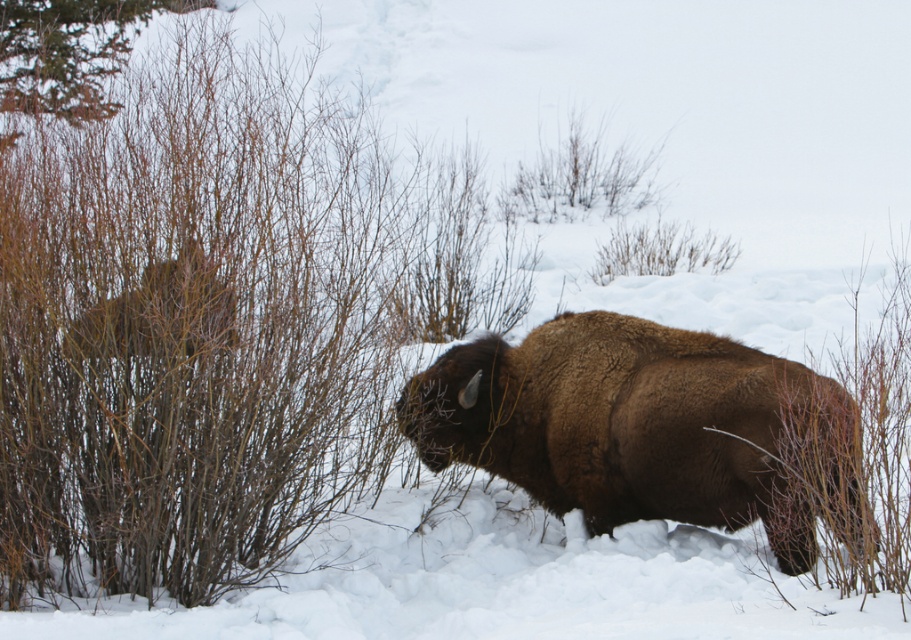
Question: Which point is closer to the camera?

Choices:
 (A) brown furry bison at center
 (B) brown woody bush at left

Answer: (B)

Question: Can you confirm if brown woody bush at left is positioned above brown furry bison at center?

Choices:
 (A) yes
 (B) no

Answer: (A)

Question: Considering the relative positions of brown woody bush at left and brown furry bison at center in the image provided, where is brown woody bush at left located with respect to brown furry bison at center?

Choices:
 (A) left
 (B) right

Answer: (A)

Question: Which point is closer to the camera?

Choices:
 (A) (865, 540)
 (B) (22, 179)

Answer: (A)

Question: Does brown woody bush at left appear on the right side of brown furry bison at center?

Choices:
 (A) no
 (B) yes

Answer: (A)

Question: Which point is farther from the camera taking this photo?

Choices:
 (A) click(108, 236)
 (B) click(469, 369)

Answer: (B)